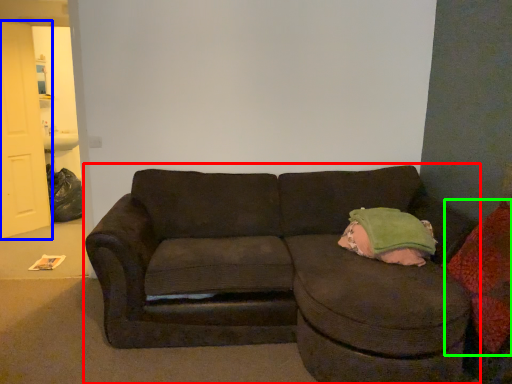
Question: Based on their relative distances, which object is nearer to studio couch (highlighted by a red box)? Choose from door (highlighted by a blue box) and throw pillow (highlighted by a green box).

Choices:
 (A) door
 (B) throw pillow

Answer: (B)